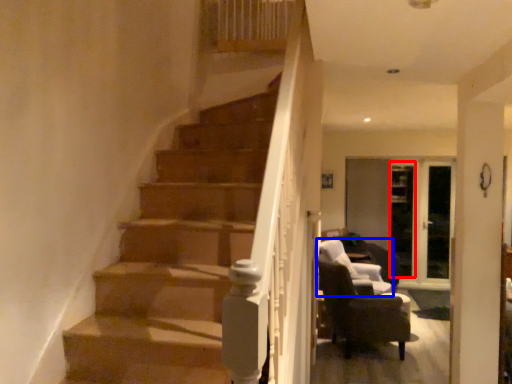
Question: Which point is closer to the camera, glass door (highlighted by a red box) or chair (highlighted by a blue box)?

Choices:
 (A) glass door
 (B) chair

Answer: (B)